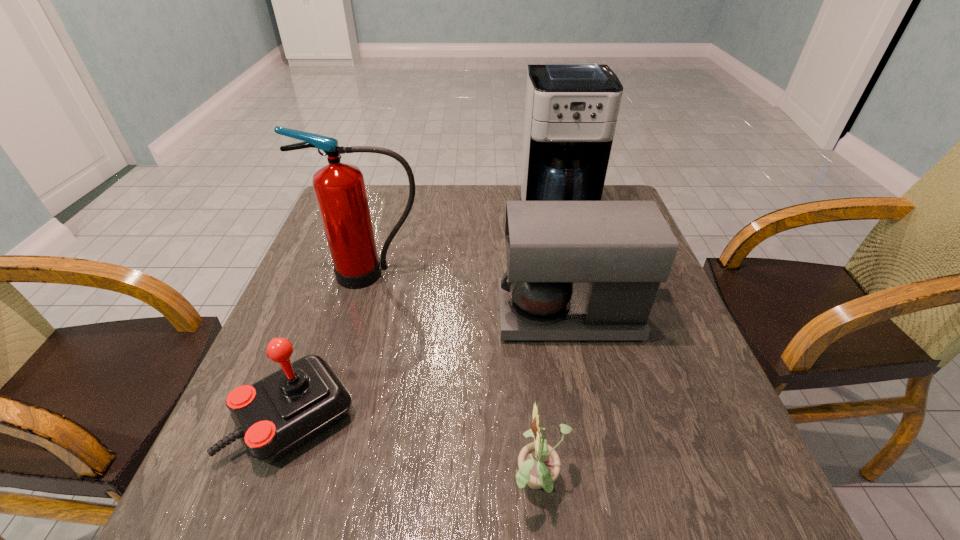
Where is `vacant space that satisfies the following two spatial constraints: 1. on the front panel of the farther coffee maker; 2. on the front-facing side of the sunflower`? The image size is (960, 540). vacant space that satisfies the following two spatial constraints: 1. on the front panel of the farther coffee maker; 2. on the front-facing side of the sunflower is located at coordinates (624, 483).

Image resolution: width=960 pixels, height=540 pixels. Identify the location of vacant space that satisfies the following two spatial constraints: 1. on the carafe side of the shorter coffee maker; 2. on the front side of the joystick. click(589, 416).

Find the location of a particular element. The image size is (960, 540). vacant space that satisfies the following two spatial constraints: 1. on the front panel of the taller coffee maker; 2. on the front-facing side of the sunflower is located at coordinates (624, 483).